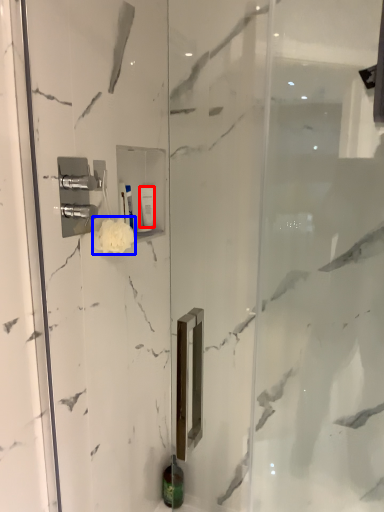
Question: Which point is further to the camera, toiletry (highlighted by a red box) or flower (highlighted by a blue box)?

Choices:
 (A) toiletry
 (B) flower

Answer: (A)